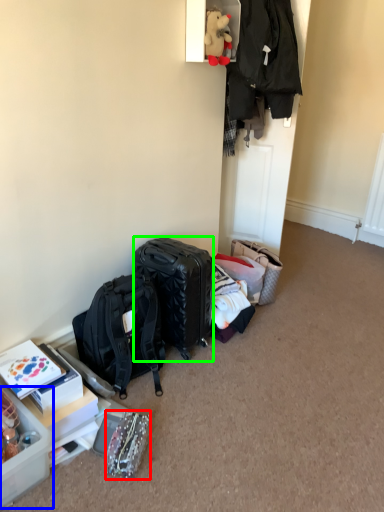
Question: Which is nearer to the bag (highlighted by a red box)? box (highlighted by a blue box) or luggage and bags (highlighted by a green box).

Choices:
 (A) box
 (B) luggage and bags

Answer: (A)